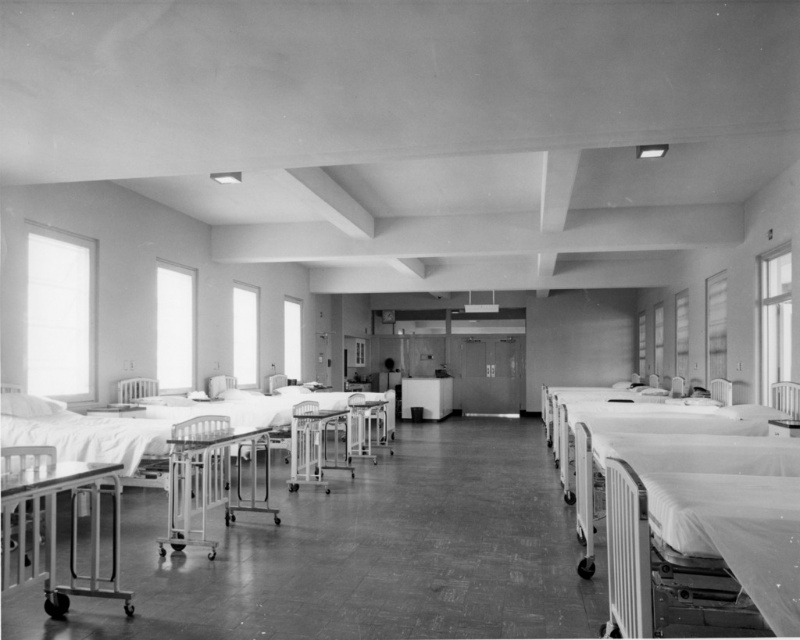
Which of these two, white smooth bed at right or metallic hospital bed at lower left, stands taller?

Standing taller between the two is metallic hospital bed at lower left.

The width and height of the screenshot is (800, 640). What do you see at coordinates (694, 522) in the screenshot? I see `white smooth bed at right` at bounding box center [694, 522].

Does point (625, 444) come closer to viewer compared to point (102, 476)?

No, it is behind (102, 476).

Identify the location of white smooth bed at right. This screenshot has height=640, width=800. coord(694,522).